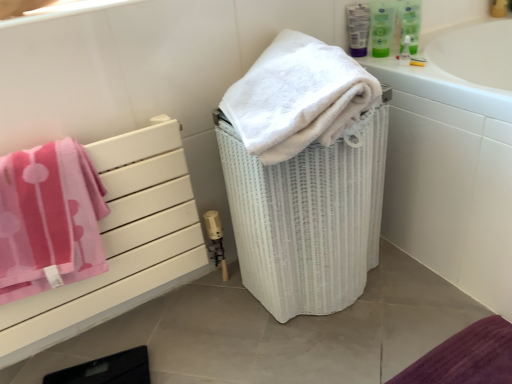
Where is `vacant area that is in front of green plastic mouthwash at upper right, arranged as the third mouthwash when viewed from the left`? The image size is (512, 384). vacant area that is in front of green plastic mouthwash at upper right, arranged as the third mouthwash when viewed from the left is located at coordinates (417, 65).